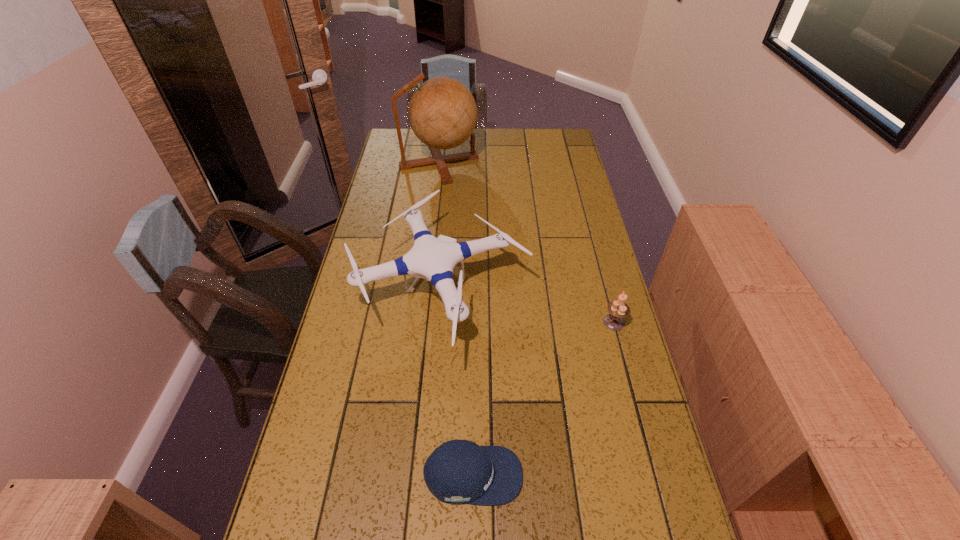
The image size is (960, 540). What are the coordinates of `free point located 0.280m on the front-facing side of the baseball cap` in the screenshot? It's located at point(647,475).

Find the location of a particular element. The height and width of the screenshot is (540, 960). object at the far edge is located at coordinates (442, 111).

Where is `globe present at the left edge`? globe present at the left edge is located at coordinates [x=442, y=111].

Find the location of a particular element. drone at the left edge is located at coordinates (431, 258).

The width and height of the screenshot is (960, 540). I want to click on object located at the right edge, so click(618, 309).

Where is `object positioned at the far left corner`? This screenshot has height=540, width=960. object positioned at the far left corner is located at coordinates (442, 111).

In the image, there is a desktop. In order to click on free space at the left edge in this screenshot , I will do `click(327, 370)`.

The image size is (960, 540). What are the coordinates of `vacant space at the right edge of the desktop` in the screenshot? It's located at (587, 280).

In the image, there is a desktop. Identify the location of vacant space at the far left corner. (x=403, y=131).

Find the location of a particular element. The width and height of the screenshot is (960, 540). vacant space that's between the second tallest object and the tallest object is located at coordinates (440, 227).